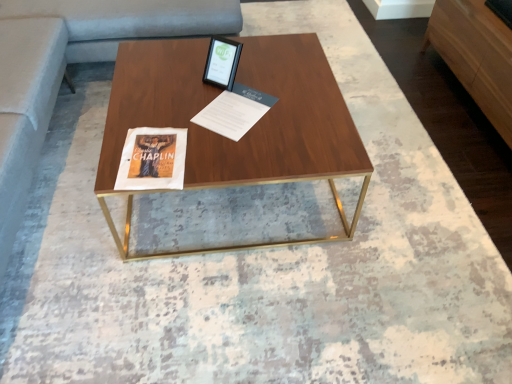
This screenshot has width=512, height=384. In order to click on vacant area that is in front of matte black tablet at upper center in this screenshot , I will do `click(216, 103)`.